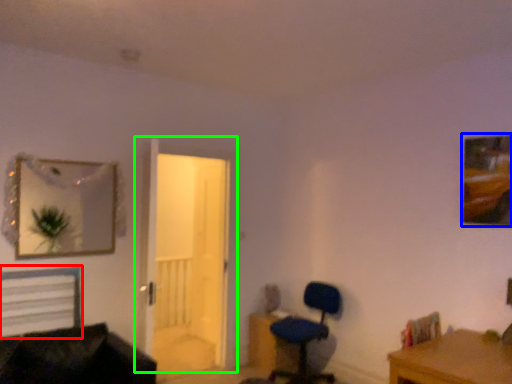
Question: Which object is positioned farthest from bed (highlighted by a red box)? Select from picture frame (highlighted by a blue box) and door (highlighted by a green box).

Choices:
 (A) picture frame
 (B) door

Answer: (A)